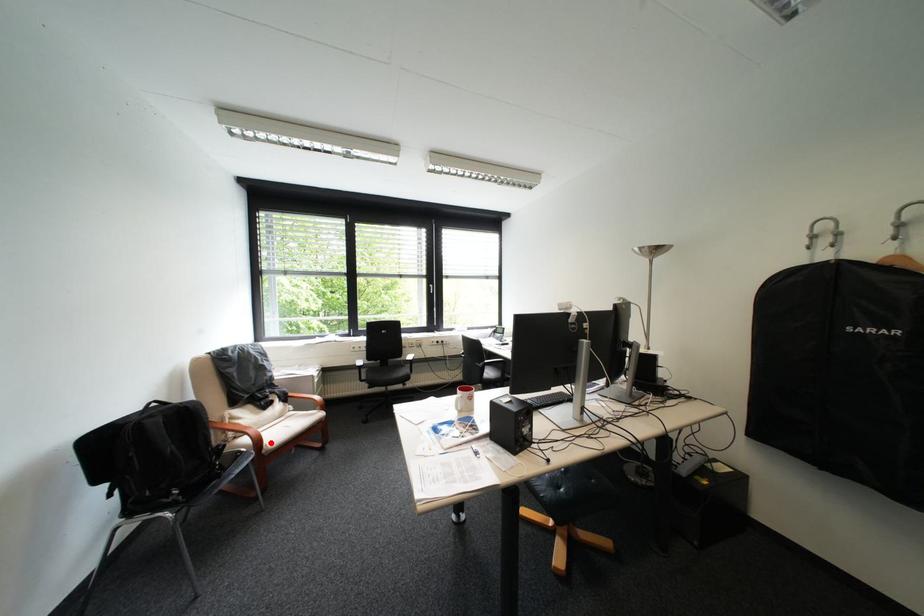
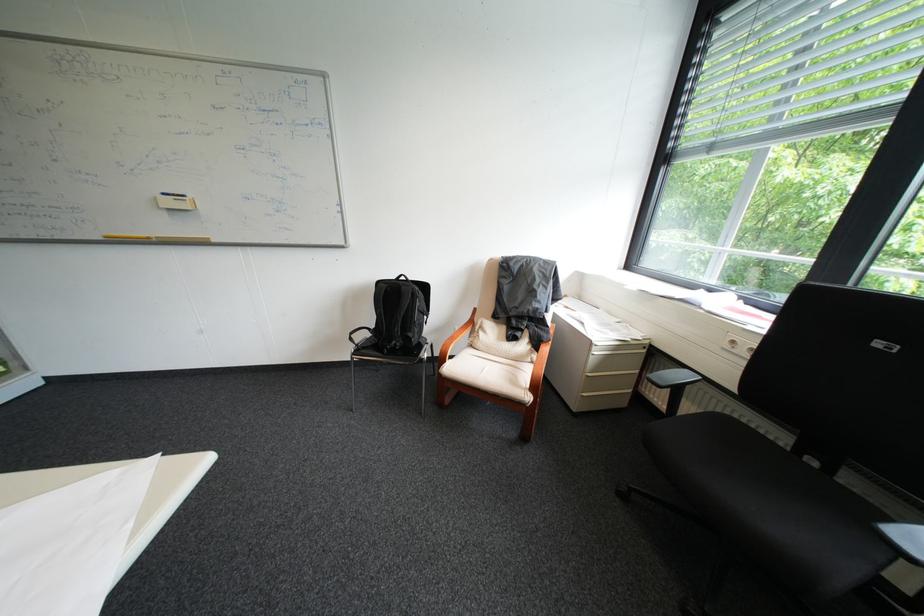
Where in the second image is the point corresponding to the highlighted location from the first image?

(456, 360)